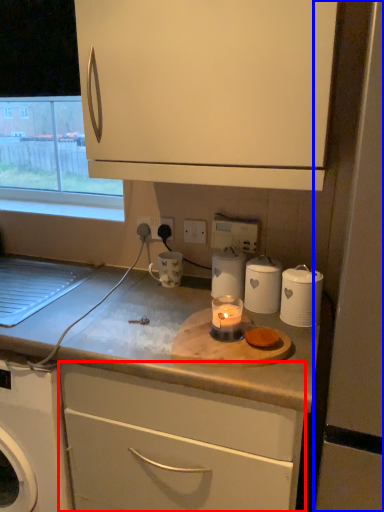
Question: Which of the following is the farthest to the observer, cabinetry (highlighted by a red box) or screen door (highlighted by a blue box)?

Choices:
 (A) cabinetry
 (B) screen door

Answer: (A)